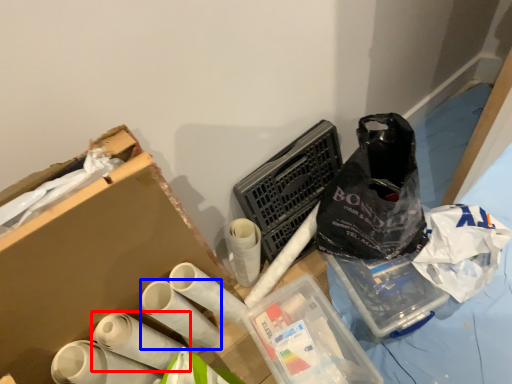
Question: Which object appears farthest to the camera in this image, toilet paper (highlighted by a red box) or toilet paper (highlighted by a blue box)?

Choices:
 (A) toilet paper
 (B) toilet paper

Answer: (B)